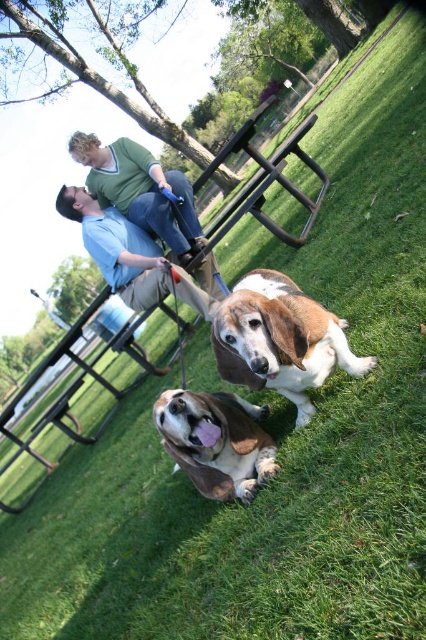
Does brown furry dog at lower center appear on the left side of blue cotton shirt at upper center?

In fact, brown furry dog at lower center is to the right of blue cotton shirt at upper center.

Who is more distant from viewer, (258, 440) or (109, 275)?

The point (109, 275) is behind.

Which is behind, point (198, 445) or point (129, 221)?

The point (129, 221) is more distant.

Where is `brown furry dog at lower center`? brown furry dog at lower center is located at coordinates [x=215, y=442].

Which is more to the left, brown and white fur dog at center or brown furry dog at lower center?

brown furry dog at lower center

Is brown and white fur dog at center wider than brown furry dog at lower center?

Yes.

Is point (299, 356) positioned after point (166, 416)?

No, it is not.

The image size is (426, 640). I want to click on brown and white fur dog at center, so tap(279, 339).

Is point (304, 384) positioned before point (141, 284)?

That is True.

Which is in front, point (278, 284) or point (106, 230)?

Point (278, 284)

Is point (294, 400) positioned in front of point (207, 300)?

That is True.

Where is `brown and white fur dog at center`? brown and white fur dog at center is located at coordinates (279, 339).